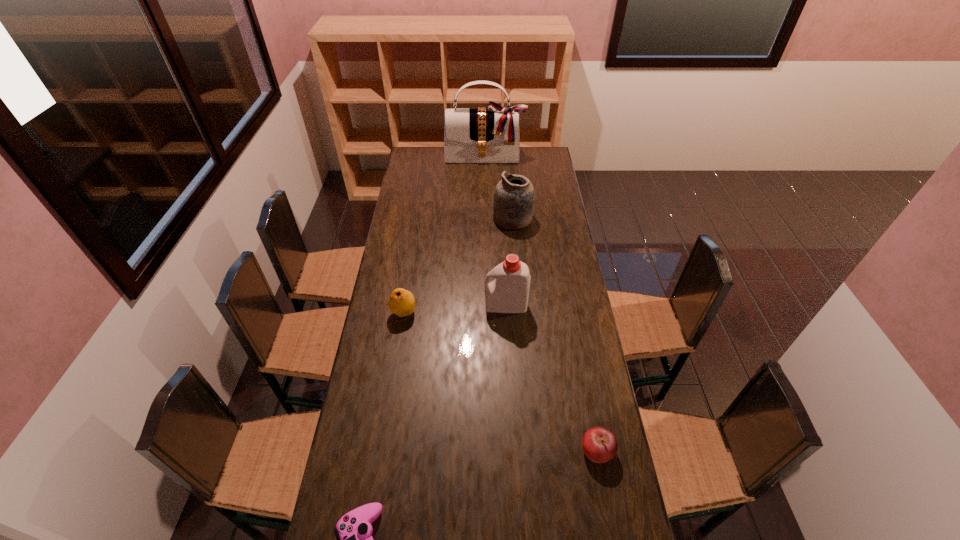
The height and width of the screenshot is (540, 960). I want to click on the farthest object, so click(492, 135).

Identify the location of satchel. (492, 135).

At what (x,y) coordinates should I click in order to perform the action: click on detergent. Please return your answer as a coordinate pair (x, y). Image resolution: width=960 pixels, height=540 pixels. Looking at the image, I should click on (508, 293).

Find the location of `the fifth nearest object`. the fifth nearest object is located at coordinates (514, 198).

The width and height of the screenshot is (960, 540). Find the location of `the fourth tallest object`. the fourth tallest object is located at coordinates (401, 302).

Where is `the second nearest object`? the second nearest object is located at coordinates (599, 444).

I want to click on apple, so click(599, 444).

Where is `blank space located on the front-facing side of the farthest object`? Image resolution: width=960 pixels, height=540 pixels. blank space located on the front-facing side of the farthest object is located at coordinates (485, 176).

This screenshot has width=960, height=540. What are the coordinates of `vacant area located on the handle side of the detergent` in the screenshot? It's located at (467, 305).

This screenshot has width=960, height=540. I want to click on blank space located on the handle side of the detergent, so click(396, 305).